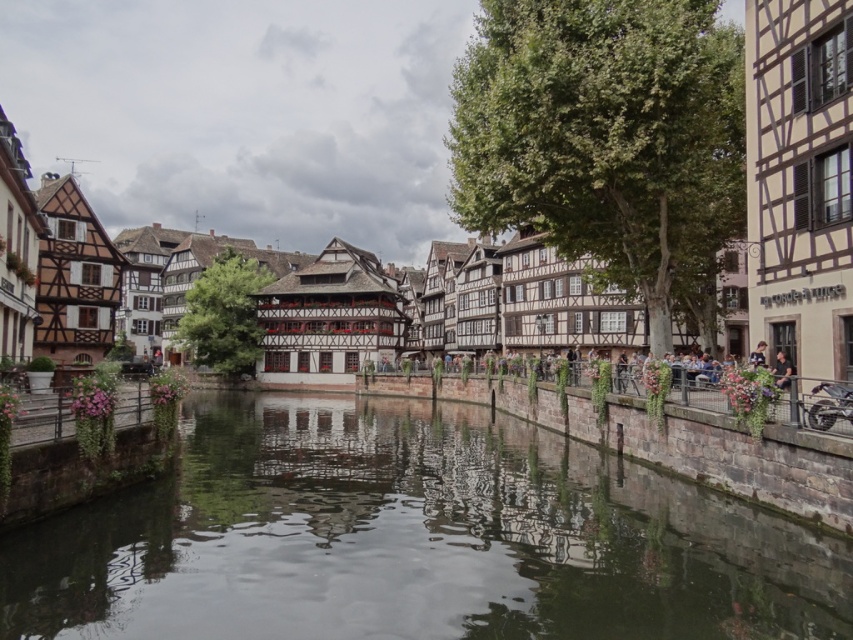
Between point (67, 598) and point (157, 88), which one is positioned behind?

Positioned behind is point (157, 88).

Is point (28, 572) positioned before point (364, 113)?

Yes, it is.

Locate an element on the screen. The image size is (853, 640). smooth concrete river at center is located at coordinates (415, 538).